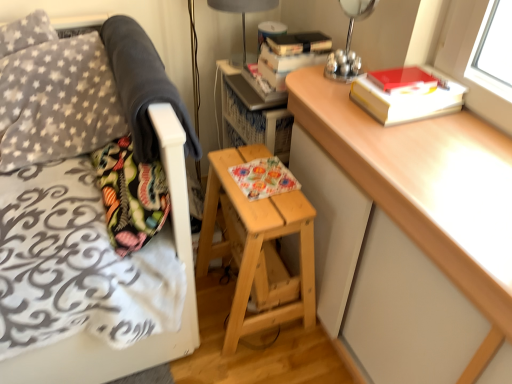
Where is `blank space situated above hardcover book at upper right, the second paperback book when ordered from top to bottom (from a real-world perspective)`? Image resolution: width=512 pixels, height=384 pixels. blank space situated above hardcover book at upper right, the second paperback book when ordered from top to bottom (from a real-world perspective) is located at coordinates (411, 77).